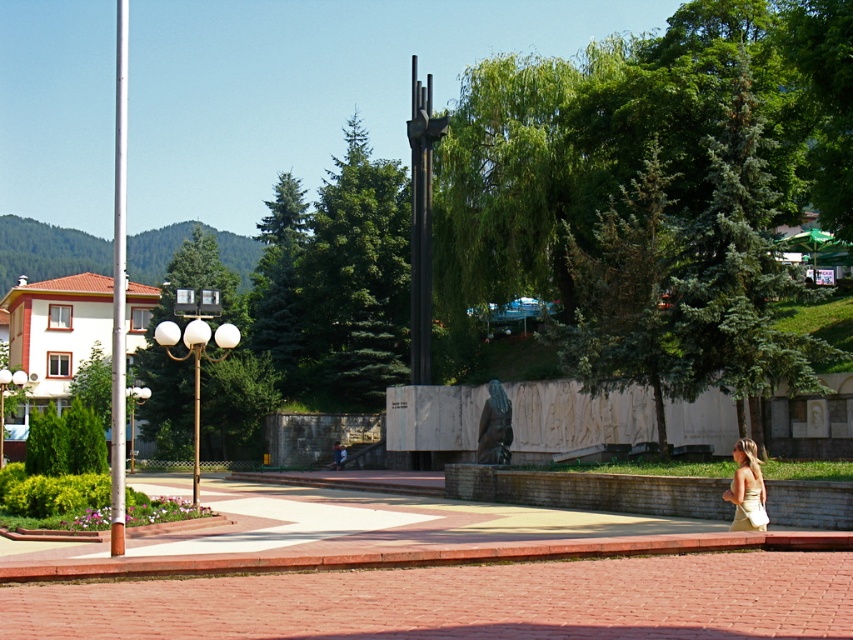
Does polished silver pole at left have a smaller size compared to beige satin dress at lower right?

No.

Between point (120, 252) and point (746, 481), which one is positioned in front?

Point (120, 252)

Image resolution: width=853 pixels, height=640 pixels. What are the coordinates of `polished silver pole at left` in the screenshot? It's located at (119, 291).

Can you confirm if light beige dress at lower right is positioned above beige satin dress at lower right?

Incorrect, light beige dress at lower right is not positioned above beige satin dress at lower right.

Which is in front, point (741, 497) or point (759, 492)?

Positioned in front is point (741, 497).

Which is in front, point (761, 528) or point (764, 525)?

Point (764, 525) is in front.

At what (x,y) coordinates should I click in order to perform the action: click on light beige dress at lower right. Please return your answer as a coordinate pair (x, y). Looking at the image, I should click on (746, 486).

Between polished silver pole at left and light beige dress at lower right, which one appears on the right side from the viewer's perspective?

From the viewer's perspective, light beige dress at lower right appears more on the right side.

Can you confirm if polished silver pole at left is positioned to the left of light beige dress at lower right?

Yes, polished silver pole at left is to the left of light beige dress at lower right.

Does point (115, 100) come closer to viewer compared to point (758, 480)?

No, (115, 100) is further to viewer.

The height and width of the screenshot is (640, 853). Identify the location of polished silver pole at left. (119, 291).